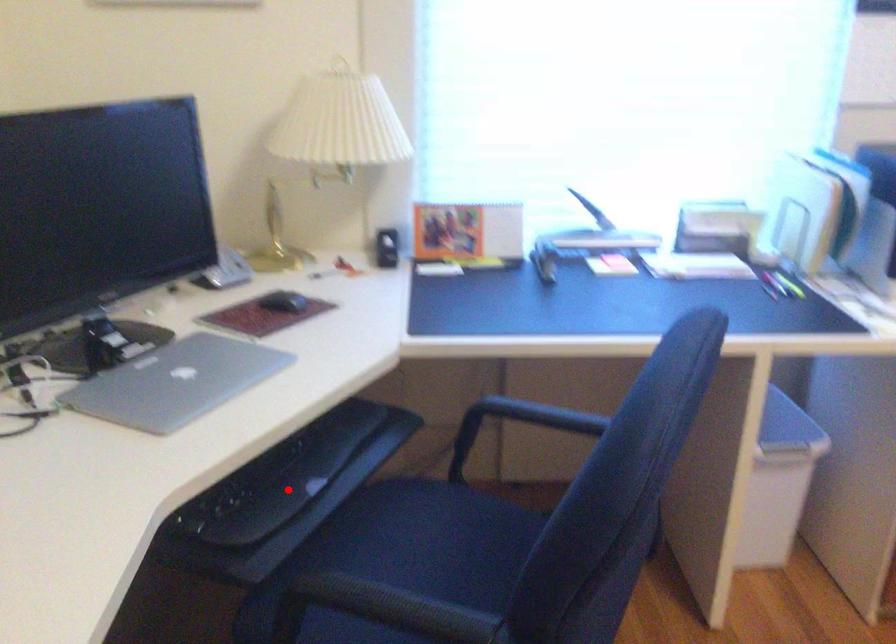
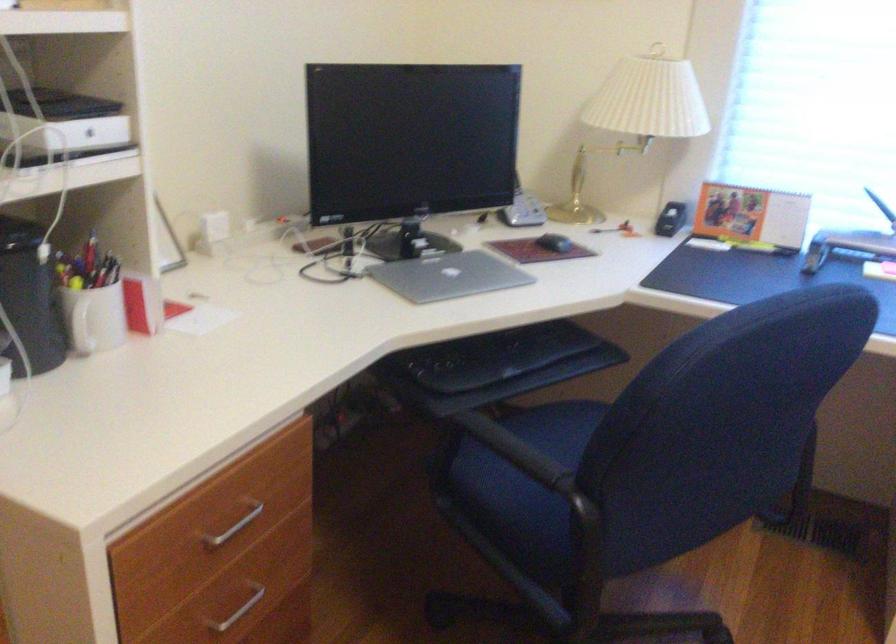
Question: I am providing you with two images of the same scene from different viewpoints. In image1, a red point is highlighted. Considering the same 3D point in image2, which of the following is correct?

Choices:
 (A) It is closer
 (B) It is farther

Answer: (B)